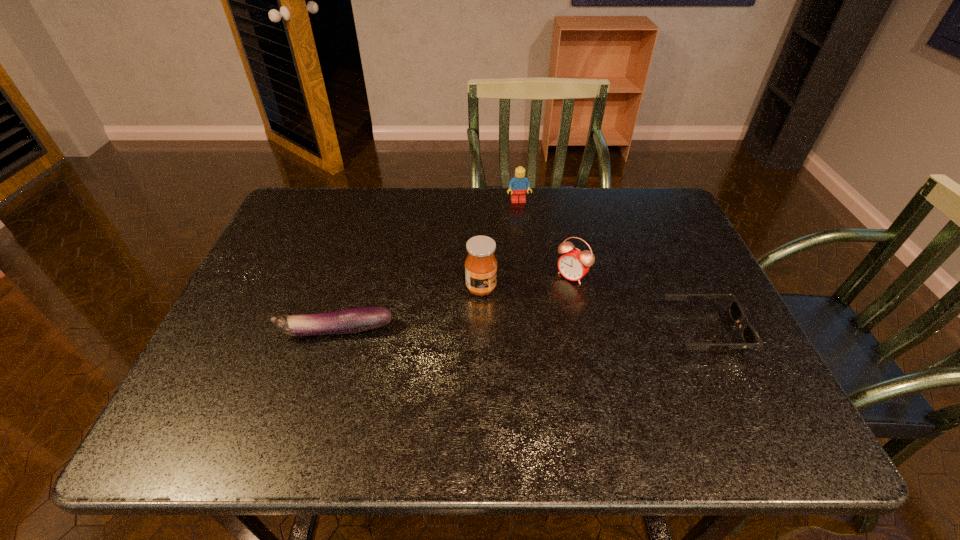
You are a GUI agent. You are given a task and a screenshot of the screen. Output one action in this format:
    pyautogui.click(x=<x>, y=<y>)
    Task: Click on the vacant space that satisfies the following two spatial constraints: 1. on the back side of the rightmost object; 2. on the temples of the second shortest object
    The height and width of the screenshot is (540, 960).
    Given the screenshot: What is the action you would take?
    pyautogui.click(x=336, y=331)

Locate an element on the screen. The width and height of the screenshot is (960, 540). free point that satisfies the following two spatial constraints: 1. on the front side of the shortest object; 2. on the temples of the second object from right to left is located at coordinates (584, 331).

Find the location of a particular element. This screenshot has width=960, height=540. vacant space that satisfies the following two spatial constraints: 1. on the front side of the shortest object; 2. on the temples of the third object from right to left is located at coordinates (533, 331).

Image resolution: width=960 pixels, height=540 pixels. What are the coordinates of `vacant space that satisfies the following two spatial constraints: 1. on the front side of the sunglasses; 2. on the temples of the second object from right to left` in the screenshot? It's located at (584, 331).

Find the location of a particular element. blank space that satisfies the following two spatial constraints: 1. on the back side of the fourth tallest object; 2. on the left side of the honey is located at coordinates (348, 288).

Find the location of a particular element. vacant space that satisfies the following two spatial constraints: 1. on the back side of the alarm clock; 2. on the right side of the leftmost object is located at coordinates (352, 275).